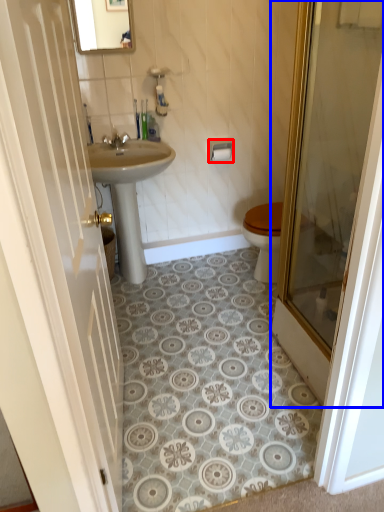
Question: Which object appears farthest to the camera in this image, towel bar (highlighted by a red box) or door (highlighted by a blue box)?

Choices:
 (A) towel bar
 (B) door

Answer: (A)